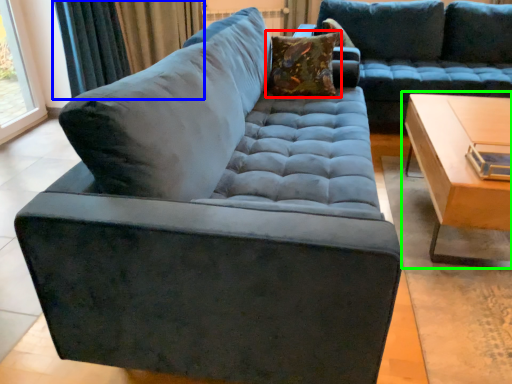
Question: Which object is positioned closest to pillow (highlighted by a red box)? Select from curtain (highlighted by a blue box) and table (highlighted by a green box).

Choices:
 (A) curtain
 (B) table

Answer: (B)